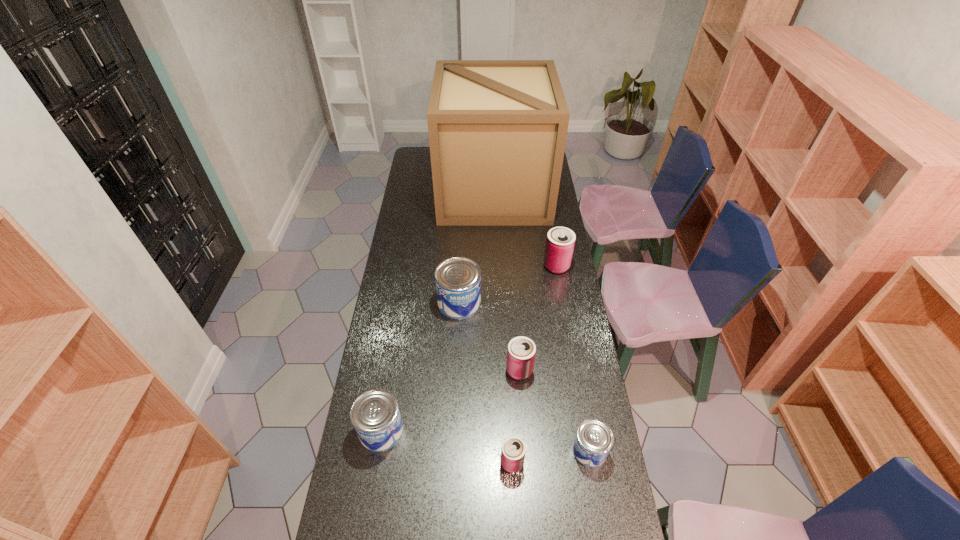
Locate an element on the screen. The width and height of the screenshot is (960, 540). empty location between the second farthest pink can and the second blue can from right to left is located at coordinates (490, 336).

The image size is (960, 540). I want to click on free space between the smallest pink can and the sixth nearest object, so click(x=534, y=364).

The image size is (960, 540). I want to click on vacant region between the tallest object and the smallest blue can, so click(541, 321).

You are a GUI agent. You are given a task and a screenshot of the screen. Output one action in this format:
    pyautogui.click(x=<x>, y=<y>)
    Task: Click on the vacant area that lies between the leftmost blue can and the second nearest pink can
    The height and width of the screenshot is (540, 960).
    Given the screenshot: What is the action you would take?
    pyautogui.click(x=450, y=401)

At what (x,y) coordinates should I click in order to perform the action: click on vacant area that lies between the leftmost object and the farthest blue can. Please return your answer as a coordinate pair (x, y). The width and height of the screenshot is (960, 540). Looking at the image, I should click on pyautogui.click(x=420, y=367).

The width and height of the screenshot is (960, 540). Identify the location of free space between the box and the second biggest pink can. (507, 281).

Image resolution: width=960 pixels, height=540 pixels. Find the location of `vacant area between the second smallest pink can and the fifth nearest object`. vacant area between the second smallest pink can and the fifth nearest object is located at coordinates (490, 336).

Image resolution: width=960 pixels, height=540 pixels. I want to click on object that is the fifth closest one to the farthest pink can, so click(513, 449).

The height and width of the screenshot is (540, 960). Identify the location of object that is the closest to the second biggest blue can. (513, 449).

Locate which can is the fourth closest to the smallest pink can. Please provide its 2D coordinates. Your answer should be formatted as a tuple, i.e. [(x, y)], where the tuple contains the x and y coordinates of a point satisfying the conditions above.

[(458, 280)]